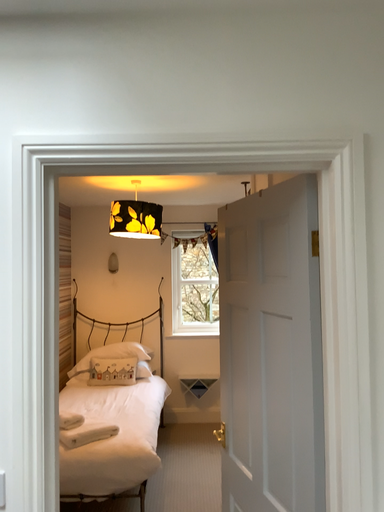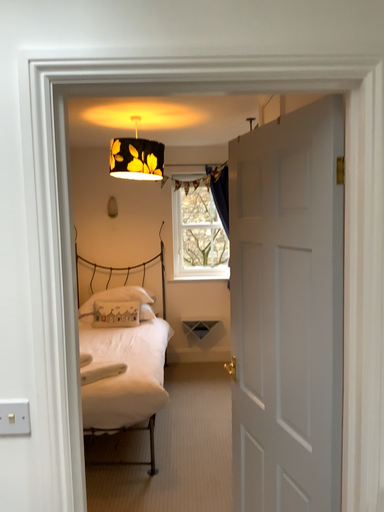
Question: Which way did the camera rotate in the video?

Choices:
 (A) rotated downward
 (B) rotated upward

Answer: (A)